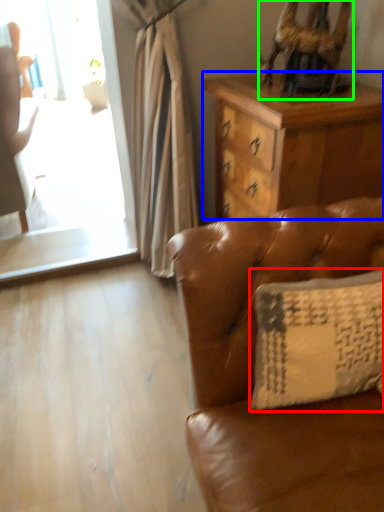
Question: Estimate the real-world distances between objects in this image. Which object is farther from pillow (highlighted by a red box), desk (highlighted by a blue box) or swivel chair (highlighted by a green box)?

Choices:
 (A) desk
 (B) swivel chair

Answer: (B)